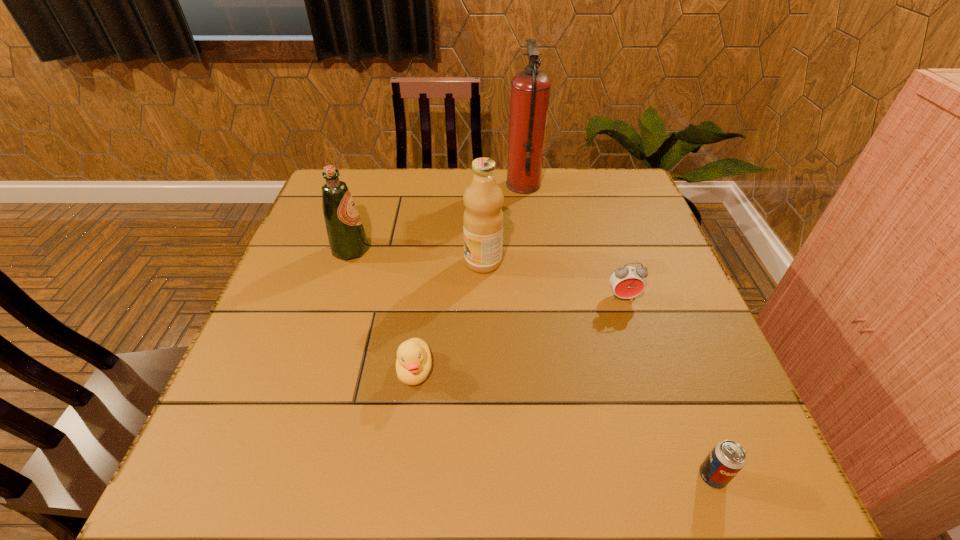
Locate an element on the screen. The width and height of the screenshot is (960, 540). blank space at the far left corner of the desktop is located at coordinates (355, 178).

What are the coordinates of `vacant space at the near left corner of the desktop` in the screenshot? It's located at (239, 501).

Where is `vacant space at the far right corner`? The width and height of the screenshot is (960, 540). vacant space at the far right corner is located at coordinates (606, 190).

Locate an element on the screen. This screenshot has width=960, height=540. unoccupied position between the farthest object and the nearest object is located at coordinates (618, 330).

Where is `free spot between the leftmost object and the third object from left to right`? The height and width of the screenshot is (540, 960). free spot between the leftmost object and the third object from left to right is located at coordinates (417, 256).

Find the location of a particular element. This screenshot has height=540, width=960. free space that is in between the third object from left to right and the shorter olive oil is located at coordinates (417, 256).

Locate an element on the screen. The width and height of the screenshot is (960, 540). free space between the alarm clock and the third tallest object is located at coordinates (487, 273).

What are the coordinates of `vacant space that is in between the third object from right to left and the second object from left to right` in the screenshot? It's located at (469, 278).

You are a GUI agent. You are given a task and a screenshot of the screen. Output one action in this format:
    pyautogui.click(x=<x>, y=<y>)
    Task: Click on the empty location between the right olive oil and the duckling
    
    Given the screenshot: What is the action you would take?
    pyautogui.click(x=449, y=316)

Where is `vacant area that lies between the right olive oil and the nearest object`? vacant area that lies between the right olive oil and the nearest object is located at coordinates (598, 369).